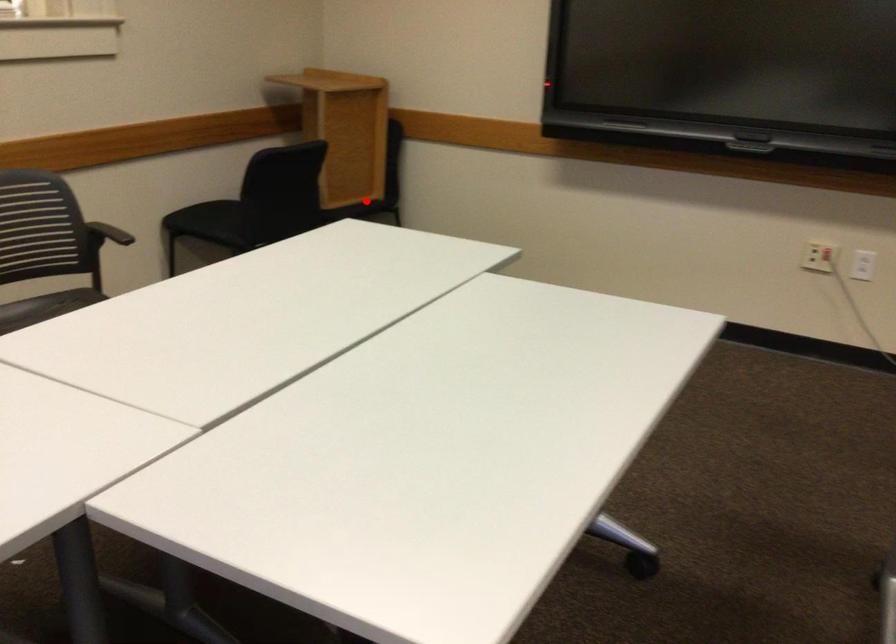
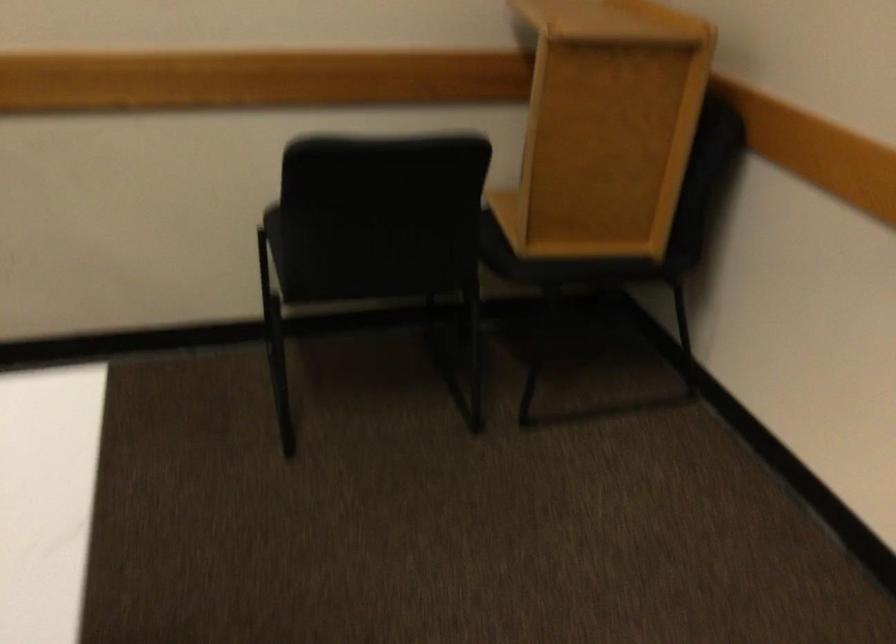
Question: A red point is marked in image1. In image2, is the corresponding 3D point closer to the camera or farther? Reply with the corresponding letter.

Choices:
 (A) The corresponding 3D point is closer.
 (B) The corresponding 3D point is farther.

Answer: (A)